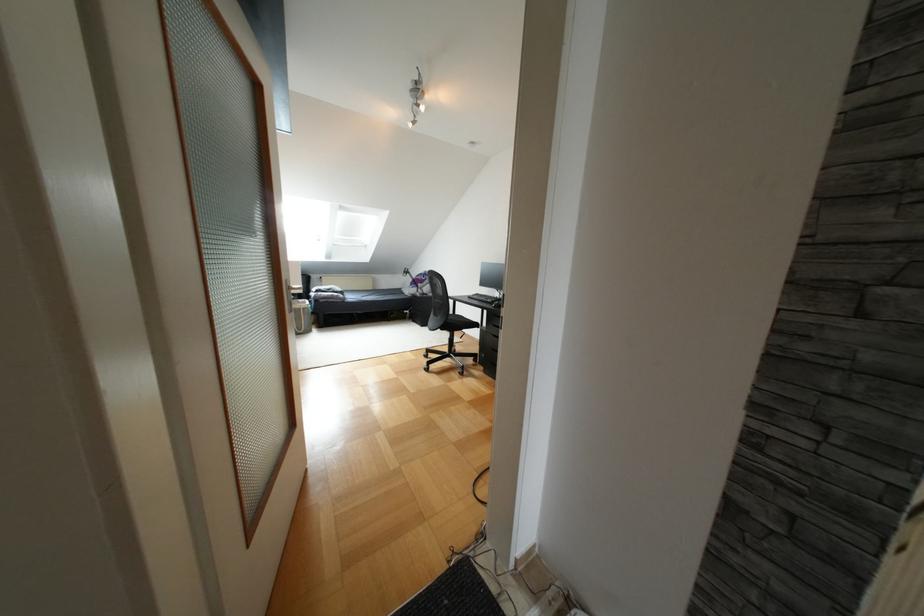
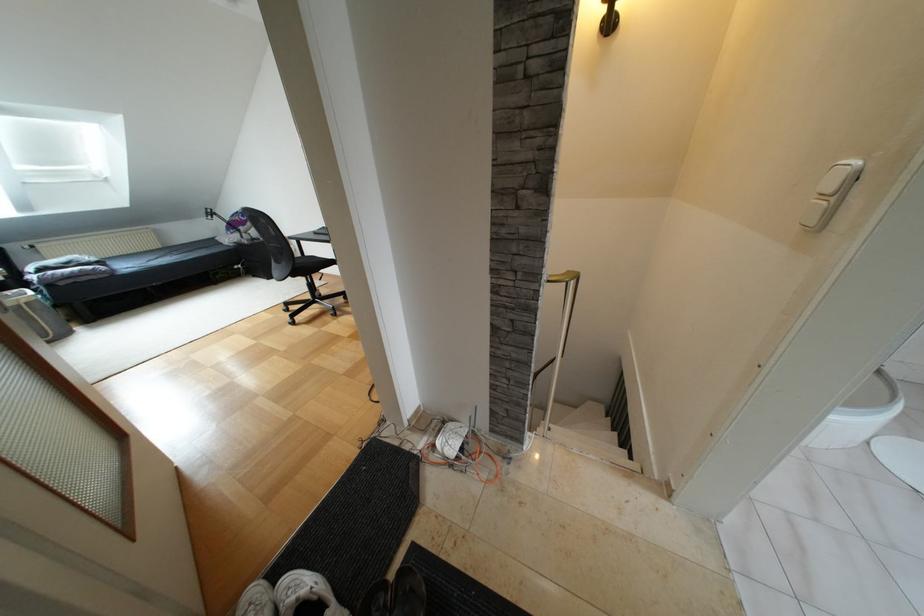
Where in the second image is the point corresponding to pixel 442 328 from the first image?

(293, 275)